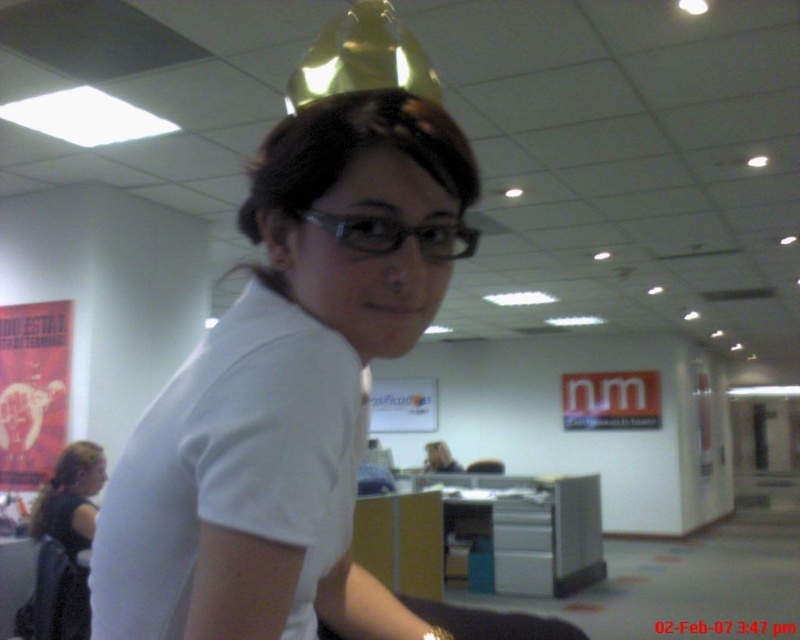
Does matte white head at center appear on the right side of blonde hair at lower left?

Indeed, matte white head at center is positioned on the right side of blonde hair at lower left.

Is matte white head at center further to the viewer compared to blonde hair at lower left?

No, it is not.

Who is more forward, (376, 296) or (52, 488)?

Point (376, 296) is more forward.

Locate an element on the screen. matte white head at center is located at coordinates (362, 212).

Who is shorter, white matte t-shirt at center or black fabric swivel chair at lower left?

Standing shorter between the two is white matte t-shirt at center.

Does point (344, 364) lie in front of point (56, 600)?

That is True.

Identify the location of white matte t-shirt at center. [x=233, y=467].

At what (x,y) coordinates should I click in order to perform the action: click on red paper poster at left. Please return your answer as a coordinate pair (x, y). The width and height of the screenshot is (800, 640). Looking at the image, I should click on (32, 390).

Is point (32, 488) closer to viewer compared to point (56, 577)?

That is False.

In order to click on red paper poster at left in this screenshot , I will do `click(32, 390)`.